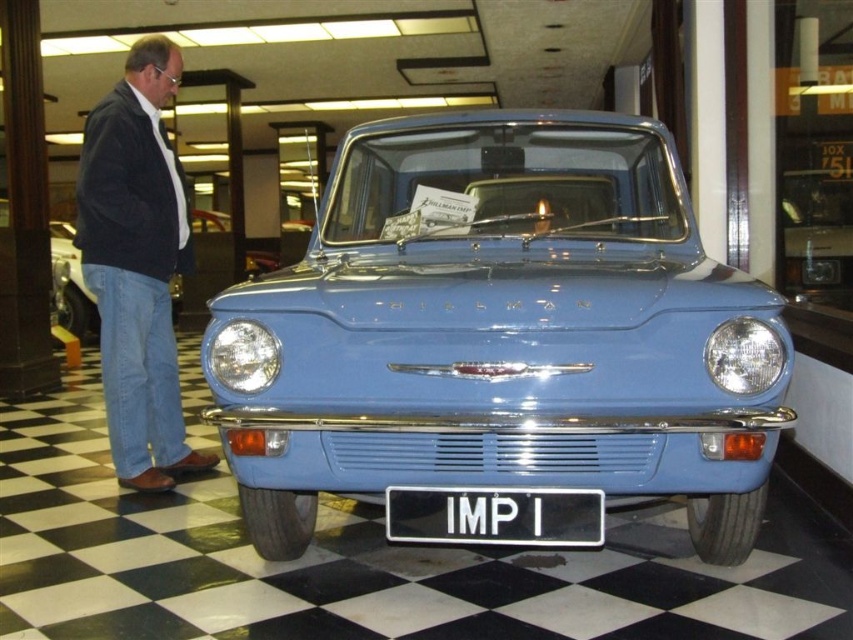
Where is the black plastic license plate at center located in terms of coordinates?

The black plastic license plate at center is located at coordinates point (495,516).

You are a photographer planning to take a photo of the matte blue car at left and the denim jeans at left. Since you want both items to appear the same size in the final image, what should you do?

Since the denim jeans at left is bigger than the matte blue car at left, you should move closer to the matte blue car at left and farther from the denim jeans at left to make them appear the same size in the photo.

You are a photographer positioned at the entrance of the showroom. You want to take a photo of the matte blue car at left without the black plastic license plate at center appearing in the frame. Is it possible to do so by adjusting your position?

The black plastic license plate at center is in front of the matte blue car at left, so you cannot avoid capturing the license plate in the photo if you are positioned at the entrance and facing the car. To exclude the license plate, you would need to position yourself in a way that the license plate is not between you and the car, but given its central position, this might not be feasible without moving the car or the license plate.